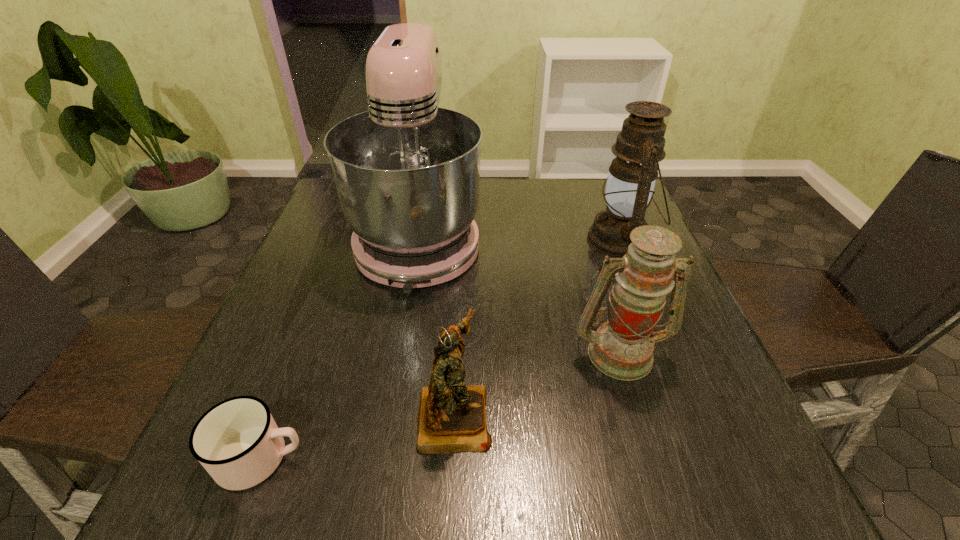
The height and width of the screenshot is (540, 960). I want to click on object that is at the far right corner, so click(630, 184).

Locate an element on the screen. vacant region at the far edge of the desktop is located at coordinates (549, 218).

The width and height of the screenshot is (960, 540). In the image, there is a desktop. What are the coordinates of `free space at the near edge` in the screenshot? It's located at (435, 483).

In the image, there is a desktop. Where is `blank space at the left edge`? blank space at the left edge is located at coordinates (295, 369).

This screenshot has width=960, height=540. In order to click on vacant space at the right edge of the desktop in this screenshot , I will do `click(723, 416)`.

This screenshot has height=540, width=960. I want to click on vacant space at the far right corner of the desktop, so click(594, 211).

Where is `blank region between the nearer oil lamp and the tallest object`? The image size is (960, 540). blank region between the nearer oil lamp and the tallest object is located at coordinates (519, 295).

Find the location of a particular element. vacant area that lies between the second shortest object and the shortest object is located at coordinates 358,437.

I want to click on vacant space that's between the mug and the fourth tallest object, so click(358, 437).

Where is `free space that is in between the mixer and the mug`? free space that is in between the mixer and the mug is located at coordinates (341, 348).